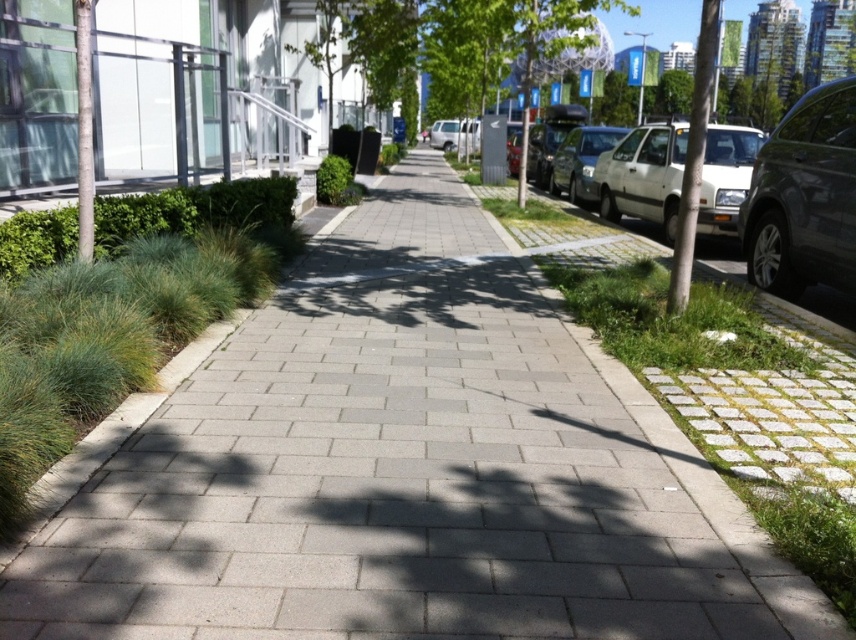
Measure the distance between green grass at right and white matte car at right.

green grass at right is 15.12 feet away from white matte car at right.

Does green grass at right have a greater width compared to white matte car at right?

Yes, green grass at right is wider than white matte car at right.

Is point (681, 339) in front of point (611, 152)?

Yes.

Find the location of a particular element. The width and height of the screenshot is (856, 640). green grass at right is located at coordinates (670, 320).

Who is taller, green grass at right or silver metallic sedan at right?

green grass at right is taller.

Find the location of a particular element. green grass at right is located at coordinates (670, 320).

Can you confirm if green grass at right is smaller than white matte van at center?

No.

Which is more to the right, green grass at right or white matte van at center?

green grass at right is more to the right.

Between point (617, 346) and point (462, 128), which one is positioned in front?

Point (617, 346) is more forward.

This screenshot has height=640, width=856. In order to click on green grass at right in this screenshot , I will do tap(670, 320).